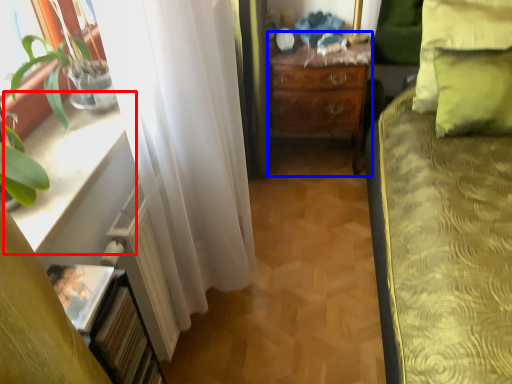
Question: Which object appears closest to the camera in this image, window sill (highlighted by a red box) or desk (highlighted by a blue box)?

Choices:
 (A) window sill
 (B) desk

Answer: (A)